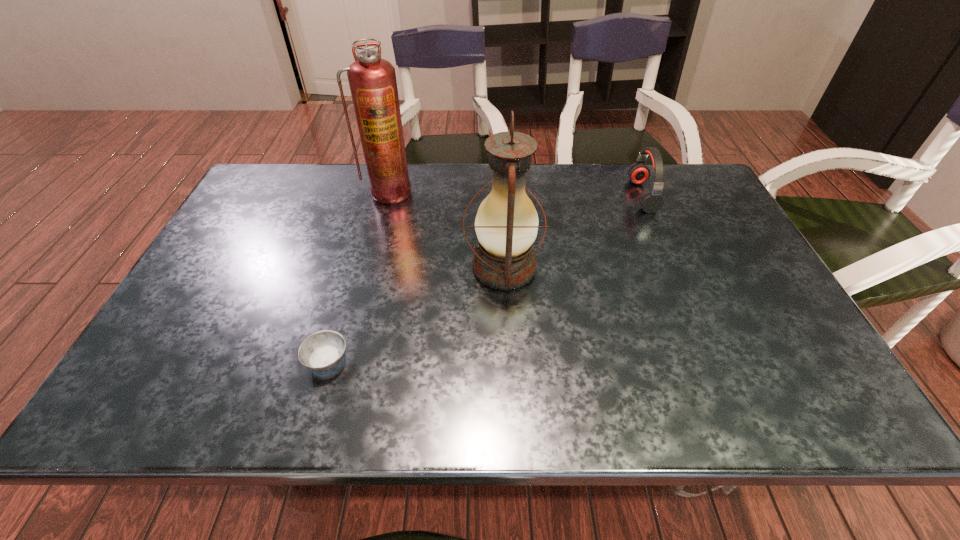
I want to click on vacant region between the ashtray and the third farthest object, so (x=416, y=314).

Locate which object ranks second in proximity to the oil lamp. Please provide its 2D coordinates. Your answer should be formatted as a tuple, i.e. [(x, y)], where the tuple contains the x and y coordinates of a point satisfying the conditions above.

[(322, 351)]

The width and height of the screenshot is (960, 540). I want to click on object that is the closest to the ashtray, so click(506, 224).

Identify the location of free region that satisfies the following two spatial constraints: 1. on the side of the third farthest object with the label; 2. on the right side of the fire extinguisher. Image resolution: width=960 pixels, height=540 pixels. (371, 267).

Where is `free spot that satisfies the following two spatial constraints: 1. on the back side of the ashtray; 2. on the left side of the oil lamp`? The image size is (960, 540). free spot that satisfies the following two spatial constraints: 1. on the back side of the ashtray; 2. on the left side of the oil lamp is located at coordinates (353, 267).